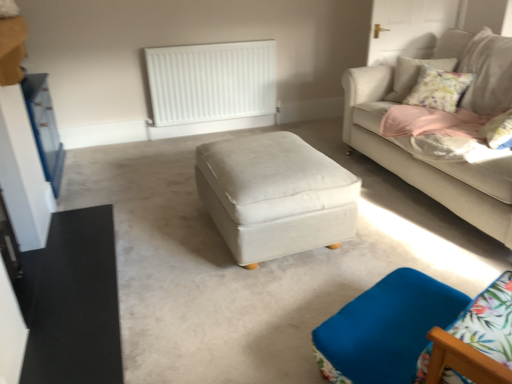
The image size is (512, 384). Identify the location of vacant region above blue fabric swivel chair at lower right (from a real-world perspective). (394, 312).